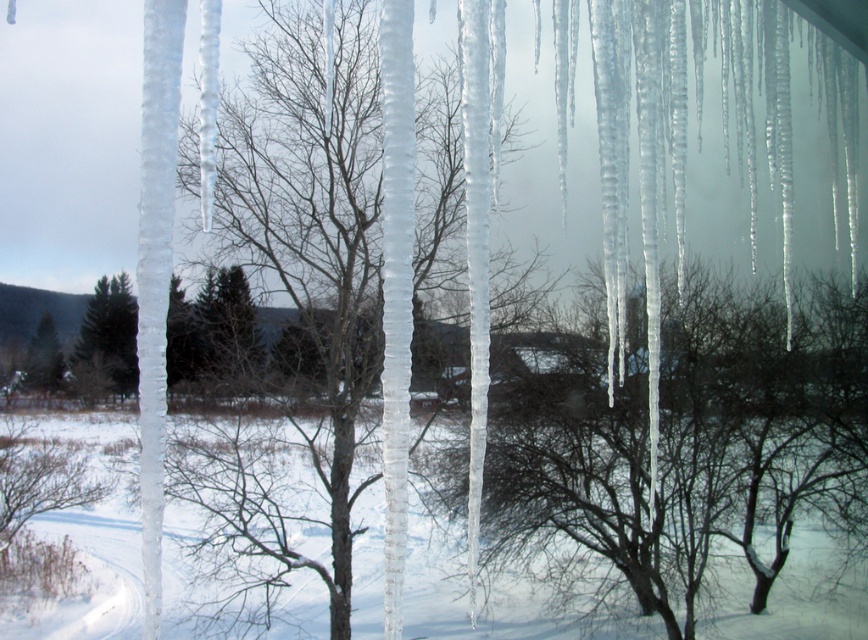
Question: Can you confirm if translucent ice at center is positioned to the left of green matte tree at left?

Choices:
 (A) yes
 (B) no

Answer: (B)

Question: Which point appears closest to the camera in this image?

Choices:
 (A) (353, 342)
 (B) (31, 362)

Answer: (A)

Question: Can you confirm if transparent ice tree at center is positioned to the right of green matte tree at left?

Choices:
 (A) yes
 (B) no

Answer: (A)

Question: Can you confirm if translucent ice at center is positioned to the right of green matte tree at center?

Choices:
 (A) no
 (B) yes

Answer: (B)

Question: Which of these objects is positioned farthest from the transparent ice tree at center?

Choices:
 (A) green matte tree at center
 (B) green matte evergreen tree at center

Answer: (A)

Question: Estimate the real-world distances between objects in this image. Which object is closer to the green matte tree at left?

Choices:
 (A) translucent ice at center
 (B) transparent ice tree at center
 (C) green matte tree at center
 (D) green matte evergreen tree at center

Answer: (C)